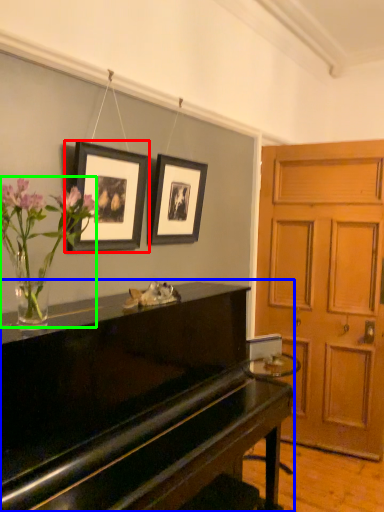
Question: Estimate the real-world distances between objects in this image. Which object is closer to picture frame (highlighted by a red box), piano (highlighted by a blue box) or floral arrangement (highlighted by a green box)?

Choices:
 (A) piano
 (B) floral arrangement

Answer: (B)